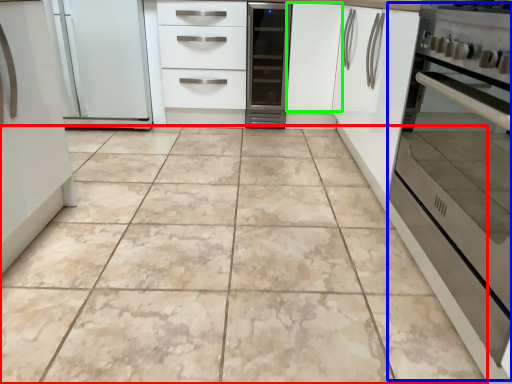
Question: Which is nearer to the ceramic tile (highlighted by a red box)? oven (highlighted by a blue box) or cabinetry (highlighted by a green box).

Choices:
 (A) oven
 (B) cabinetry

Answer: (A)